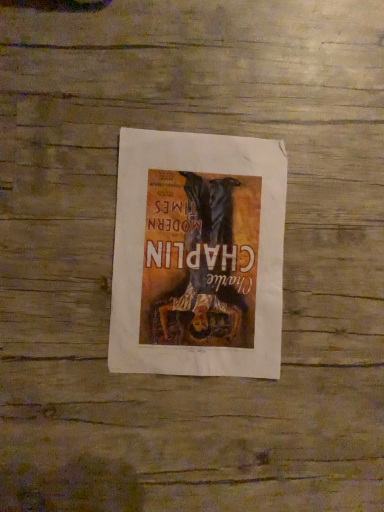
In order to click on free spot above white paper poster at center (from a real-world perspective) in this screenshot , I will do `click(201, 254)`.